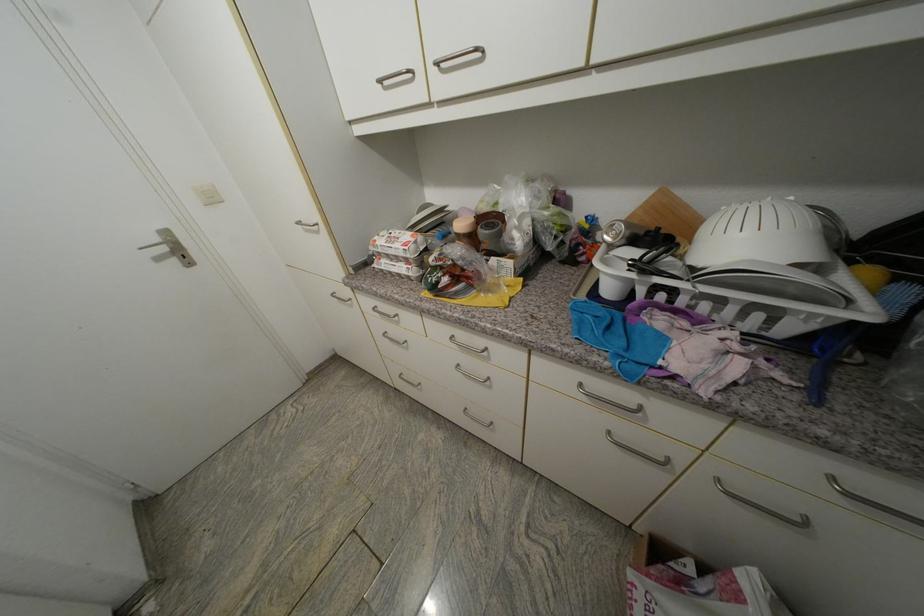
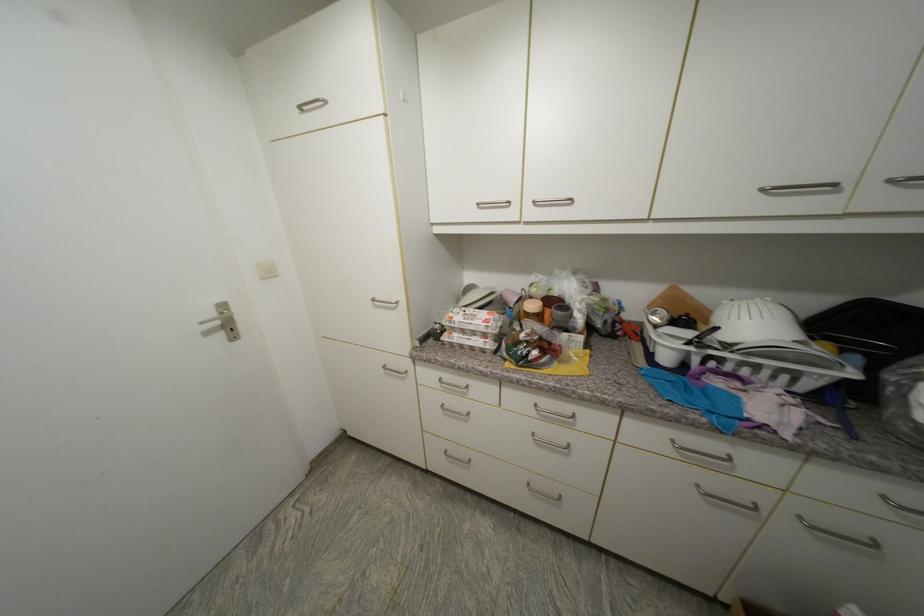
The point at (381, 243) is marked in the first image. Where is the corresponding point in the second image?

(457, 318)